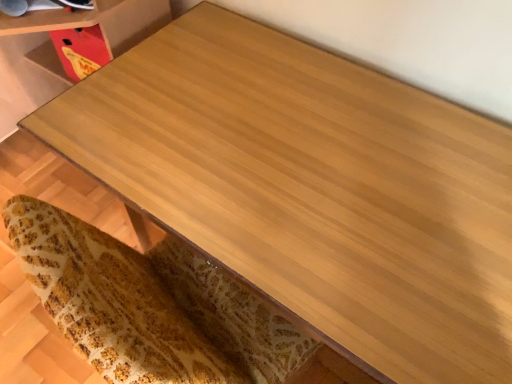
Find the location of `matte cardboard box at upper left`. matte cardboard box at upper left is located at coordinates (67, 48).

This screenshot has height=384, width=512. What do you see at coordinates (67, 48) in the screenshot?
I see `matte cardboard box at upper left` at bounding box center [67, 48].

You are a GUI agent. You are given a task and a screenshot of the screen. Output one action in this format:
    pyautogui.click(x=<x>, y=<y>)
    Task: Click on the matte cardboard box at upper left
    Image resolution: width=512 pixels, height=384 pixels.
    Given the screenshot: What is the action you would take?
    pyautogui.click(x=67, y=48)